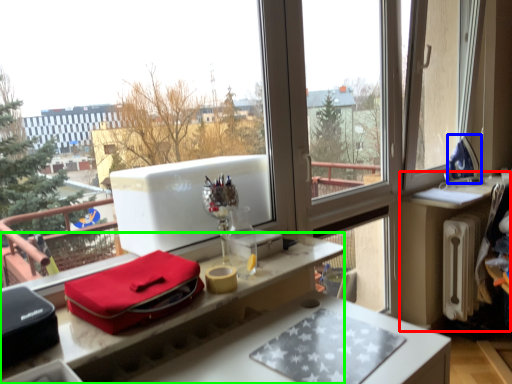
Question: Which object is the farthest from table (highlighted by a red box)? Choose among these: appliance (highlighted by a blue box) or desk (highlighted by a green box).

Choices:
 (A) appliance
 (B) desk

Answer: (B)